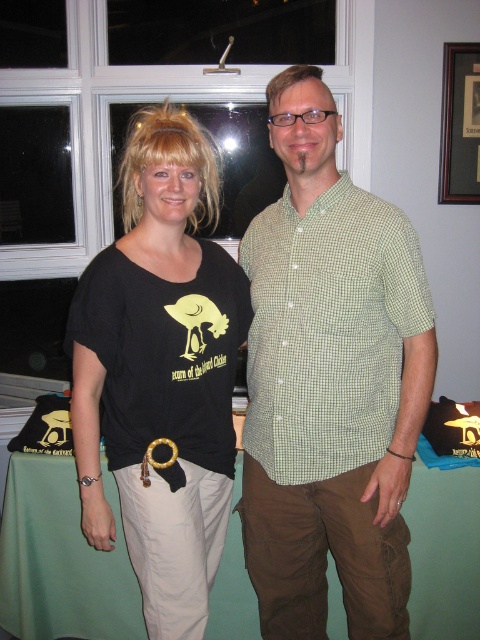
Is point (395, 324) closer to viewer compared to point (458, 628)?

Yes, point (395, 324) is closer to viewer.

You are a GUI agent. You are given a task and a screenshot of the screen. Output one action in this format:
    pyautogui.click(x=<x>, y=<y>)
    Task: Click on the green checkered shirt at center
    The image size is (480, 640).
    Given the screenshot: What is the action you would take?
    pyautogui.click(x=330, y=381)

Identify the location of green checkered shirt at center. The height and width of the screenshot is (640, 480). (330, 381).

Does green checkered shirt at center appear over black matte t-shirt at center?

No.

Measure the distance from green checkered shirt at center to black matte t-shirt at center.

green checkered shirt at center is 9.20 inches from black matte t-shirt at center.

Who is more forward, (336, 412) or (108, 420)?

Point (336, 412) is in front.

The width and height of the screenshot is (480, 640). I want to click on green checkered shirt at center, so click(330, 381).

Locate an element on the screen. This screenshot has width=480, height=640. black matte t-shirt at center is located at coordinates (160, 372).

Who is more distant from viewer, (204,285) or (60,461)?

The point (60,461) is more distant.

Find the location of a particular element. black matte t-shirt at center is located at coordinates 160,372.